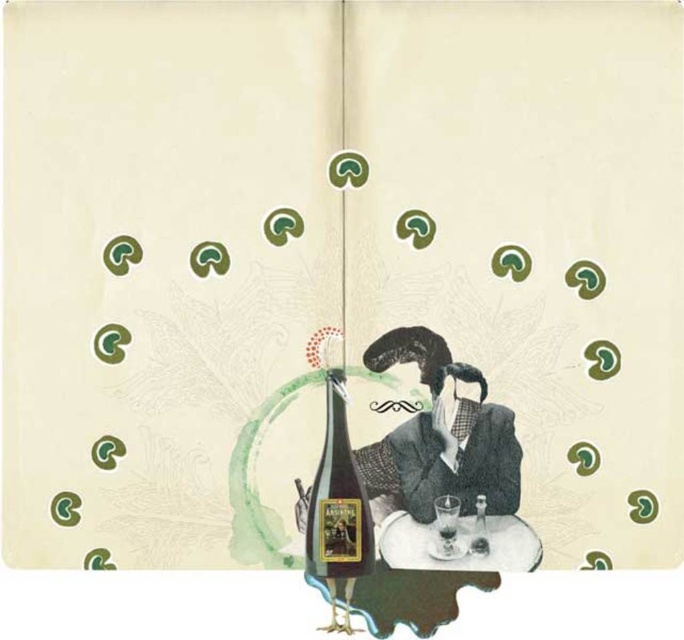
Question: In this image, where is translucent glass bottle at center located relative to transparent glass at lower center?

Choices:
 (A) below
 (B) above

Answer: (B)

Question: Which of the following is the farthest from the observer?

Choices:
 (A) (345, 548)
 (B) (453, 529)

Answer: (B)

Question: Which object is the farthest from the shiny dark green bottle at center?

Choices:
 (A) translucent glass bottle at center
 (B) transparent glass at center
 (C) white wood table at center

Answer: (A)

Question: Estimate the real-world distances between objects in this image. Which object is closer to the translucent glass bottle at center?

Choices:
 (A) transparent glass at center
 (B) shiny dark green bottle at center

Answer: (A)

Question: Can you confirm if white wood table at center is positioned below transparent glass at lower center?

Choices:
 (A) yes
 (B) no

Answer: (A)

Question: Considering the relative positions of translucent glass bottle at center and transparent glass at lower center in the image provided, where is translucent glass bottle at center located with respect to transparent glass at lower center?

Choices:
 (A) right
 (B) left

Answer: (A)